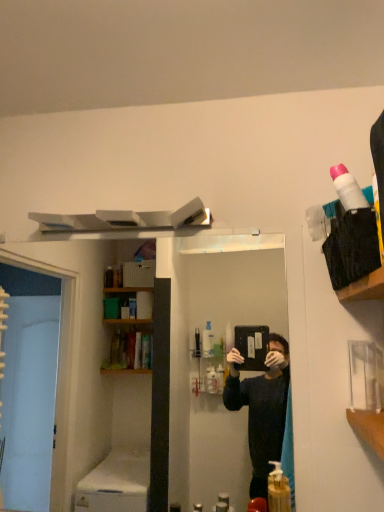
Question: Can you confirm if translucent yellow liquid at lower center is thinner than white matte soap dispenser at lower center?

Choices:
 (A) yes
 (B) no

Answer: (B)

Question: Is translucent yellow liquid at lower center taller than white matte soap dispenser at lower center?

Choices:
 (A) no
 (B) yes

Answer: (B)

Question: Is translucent yellow liquid at lower center positioned behind white matte soap dispenser at lower center?

Choices:
 (A) yes
 (B) no

Answer: (B)

Question: Could you tell me if translucent yellow liquid at lower center is facing white matte soap dispenser at lower center?

Choices:
 (A) yes
 (B) no

Answer: (B)

Question: Can you confirm if translucent yellow liquid at lower center is shorter than white matte soap dispenser at lower center?

Choices:
 (A) no
 (B) yes

Answer: (A)

Question: Can you confirm if translucent yellow liquid at lower center is wider than white matte soap dispenser at lower center?

Choices:
 (A) no
 (B) yes

Answer: (B)

Question: Would you say white matte soap dispenser at lower center is outside translucent yellow liquid at lower center?

Choices:
 (A) no
 (B) yes

Answer: (B)

Question: Is white matte soap dispenser at lower center thinner than translucent yellow liquid at lower center?

Choices:
 (A) yes
 (B) no

Answer: (A)

Question: Does white matte soap dispenser at lower center have a smaller size compared to translucent yellow liquid at lower center?

Choices:
 (A) yes
 (B) no

Answer: (A)

Question: Does white matte soap dispenser at lower center have a greater height compared to translucent yellow liquid at lower center?

Choices:
 (A) no
 (B) yes

Answer: (A)

Question: Is white matte soap dispenser at lower center wider than translucent yellow liquid at lower center?

Choices:
 (A) no
 (B) yes

Answer: (A)

Question: Is the surface of white matte soap dispenser at lower center in direct contact with translucent yellow liquid at lower center?

Choices:
 (A) no
 (B) yes

Answer: (A)

Question: Is white matte soap dispenser at lower center to the left or to the right of translucent yellow liquid at lower center in the image?

Choices:
 (A) right
 (B) left

Answer: (B)